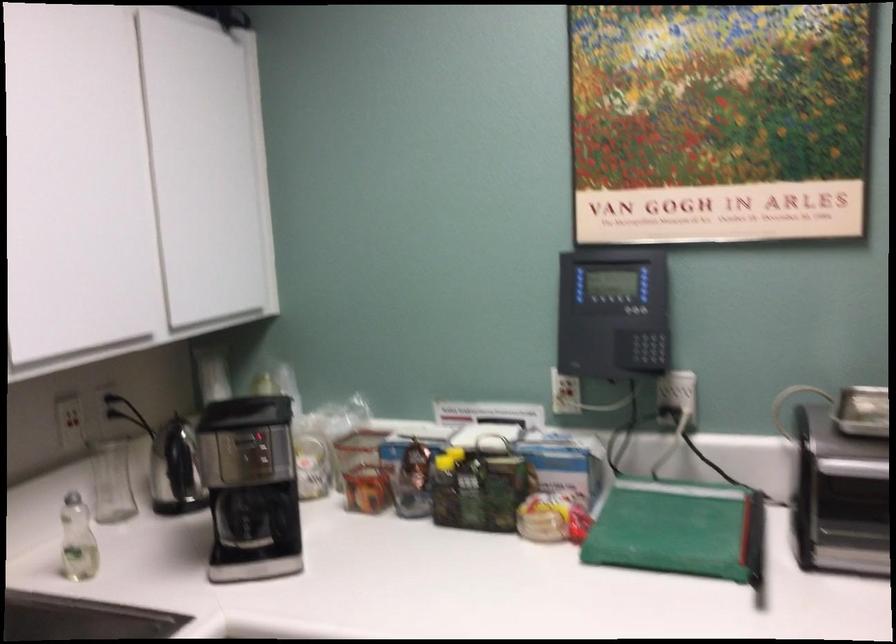
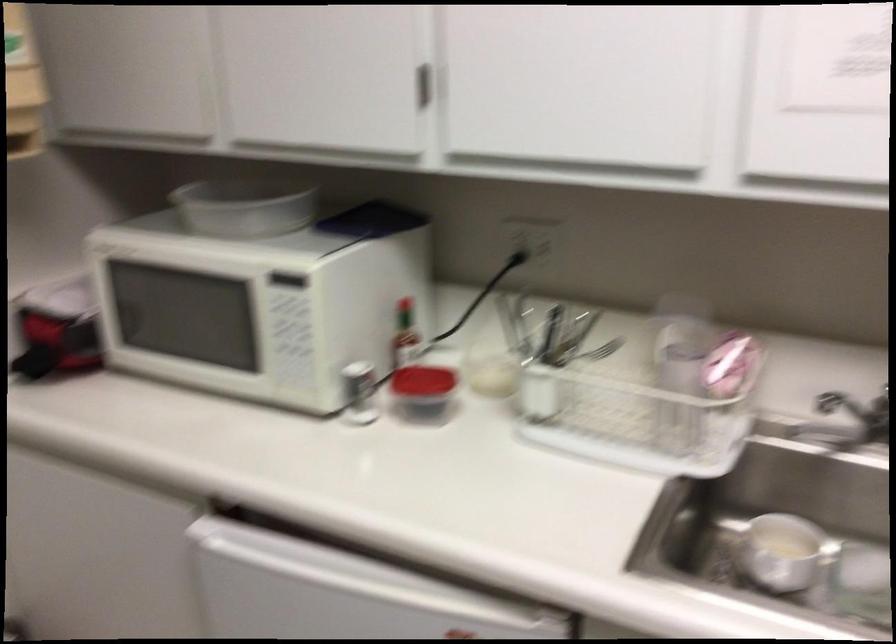
How did the camera likely rotate?

The rotation direction of the camera is left-down.